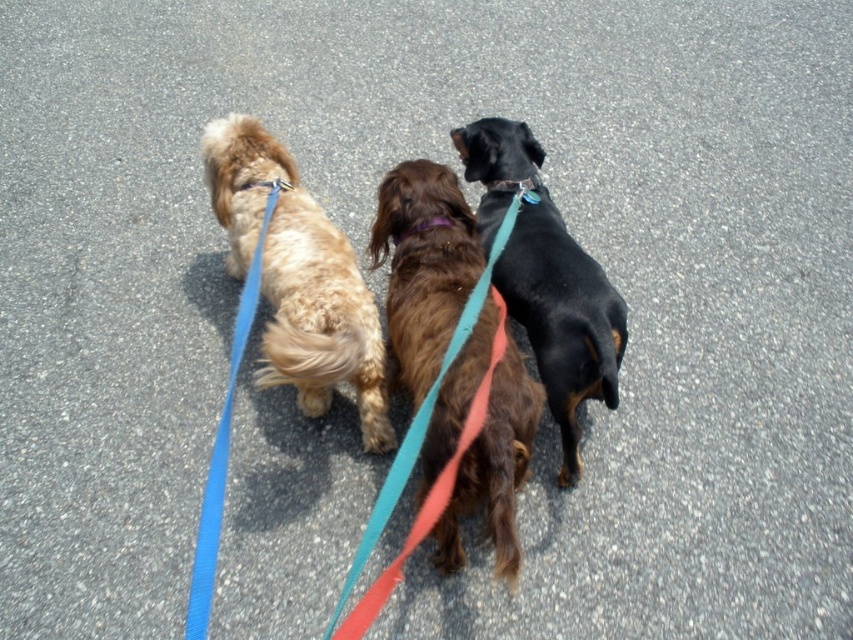
Which is behind, point (479, 403) or point (204, 522)?

Point (204, 522)

Does teal fabric leash at center have a greater width compared to blue fabric leash at left?

Yes, teal fabric leash at center is wider than blue fabric leash at left.

Where is `teal fabric leash at center`? teal fabric leash at center is located at coordinates (421, 449).

This screenshot has width=853, height=640. In order to click on teal fabric leash at center in this screenshot , I will do `click(421, 449)`.

Is black smooth dog at center below purple fabric neckband at center?

Indeed, black smooth dog at center is positioned under purple fabric neckband at center.

Is point (546, 365) positioned behind point (399, 230)?

That is False.

The height and width of the screenshot is (640, 853). What do you see at coordinates (546, 280) in the screenshot?
I see `black smooth dog at center` at bounding box center [546, 280].

Identify the location of black smooth dog at center. (546, 280).

Is light brown fur at left closer to the viewer compared to blue fabric leash at left?

No, it is not.

Is light brown fur at left bigger than blue fabric leash at left?

Yes, light brown fur at left is bigger than blue fabric leash at left.

The height and width of the screenshot is (640, 853). What are the coordinates of `light brown fur at left` in the screenshot? It's located at (297, 276).